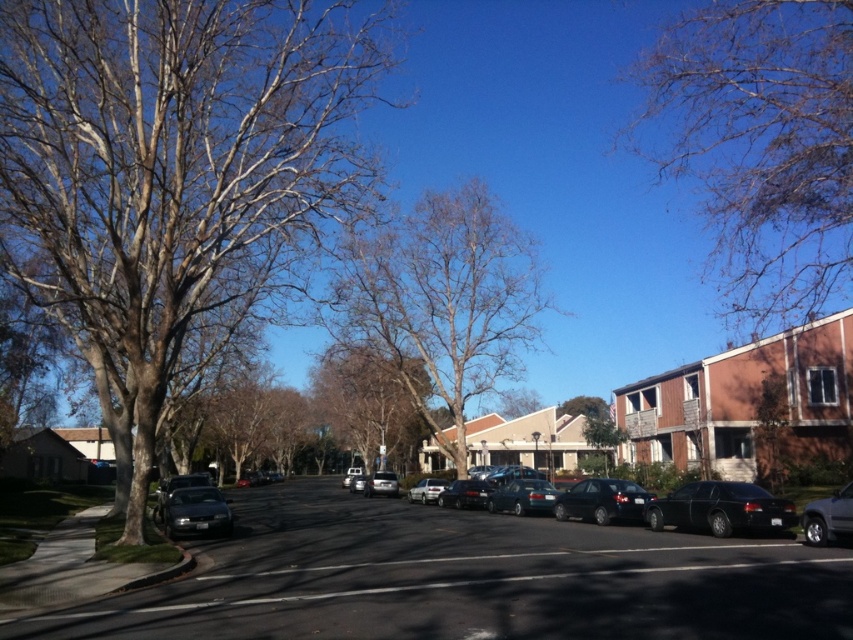
You are standing on the residential street and want to take a photo of both the bare wood tree at left and the bare branches at upper right. Which object should you focus on first to ensure both are in the frame?

You should focus on the bare wood tree at left first because it is closer to the viewer than the bare branches at upper right, ensuring both are in the frame.

You are standing at the beginning of the residential street and want to walk towards the two points marked in the image. Which point, point (196, 28) or point (695, 140), will you reach first?

You will reach point (196, 28) first because it is closer to the viewer than point (695, 140).

You are a delivery robot with a maximum range of 40 meters. You need to deliver a package from the satin black sedan at center to the brown wood tree at center. Can you complete the delivery without needing a recharge?

The distance between the satin black sedan at center and the brown wood tree at center is 39.84 meters, which is within your 40 meter range. Yes, you can complete the delivery without needing a recharge.